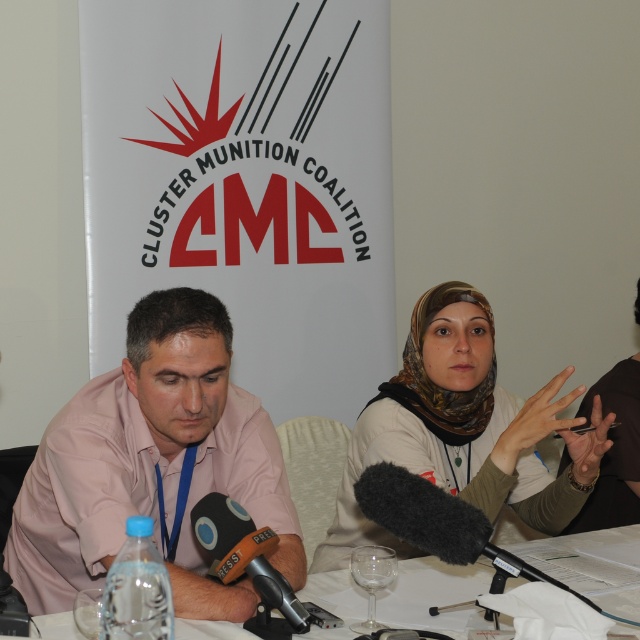
Question: Considering the real-world distances, which object is closest to the white paper at center?

Choices:
 (A) black foam microphone at center
 (B) brown printed scarf at center
 (C) brown fabric handbag at upper right

Answer: (B)

Question: Does pink shirt at left come in front of brown printed scarf at center?

Choices:
 (A) no
 (B) yes

Answer: (B)

Question: Can you confirm if brown printed scarf at center is wider than brown fabric handbag at upper right?

Choices:
 (A) no
 (B) yes

Answer: (B)

Question: Which point appears farthest from the camera in this image?

Choices:
 (A) 449,627
 (B) 614,476

Answer: (B)

Question: Which object is the farthest from the brown printed scarf at center?

Choices:
 (A) black foam microphone at center
 (B) brown fabric handbag at upper right
 (C) white paper at center
 (D) pink shirt at left

Answer: (A)

Question: From the image, what is the correct spatial relationship of pink shirt at left in relation to black foam microphone at center?

Choices:
 (A) left
 (B) right

Answer: (A)